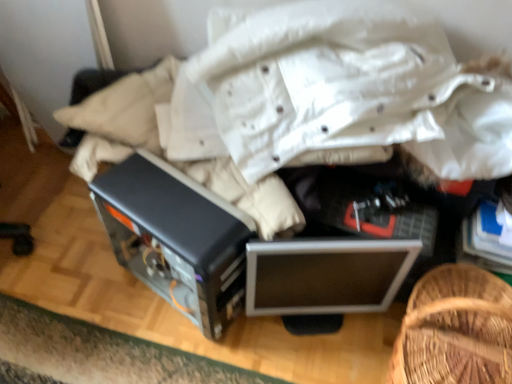
Where is `free space to the left of satin black computer case at center`? The width and height of the screenshot is (512, 384). free space to the left of satin black computer case at center is located at coordinates (87, 297).